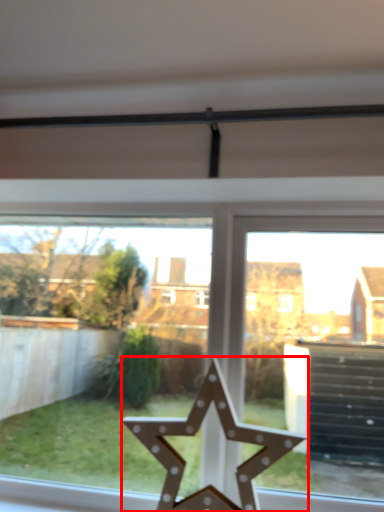
Question: From the image's perspective, considering the relative positions of star (annotated by the red box) and window in the image provided, where is star (annotated by the red box) located with respect to the staircase?

Choices:
 (A) above
 (B) below

Answer: (B)